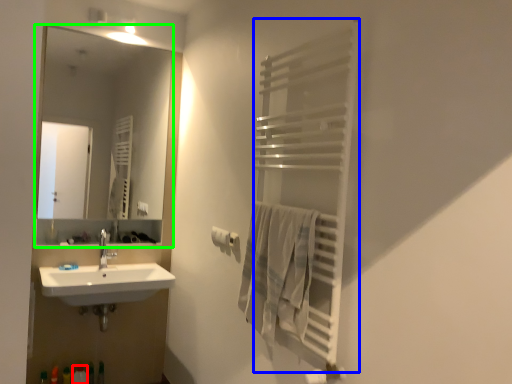
Question: Which object is the farthest from toiletry (highlighted by a red box)? Choose among these: balustrade (highlighted by a blue box) or mirror (highlighted by a green box).

Choices:
 (A) balustrade
 (B) mirror

Answer: (B)